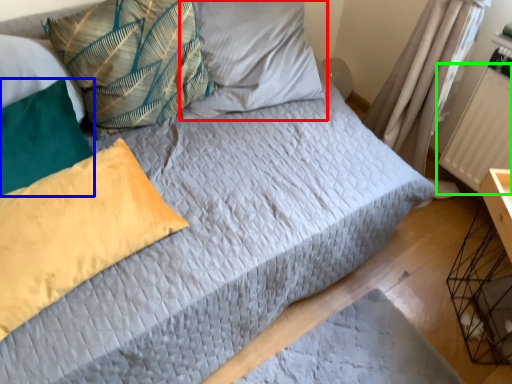
Question: Considering the real-world distances, which object is closest to pillow (highlighted by a red box)? pillow (highlighted by a blue box) or radiator (highlighted by a green box).

Choices:
 (A) pillow
 (B) radiator

Answer: (A)